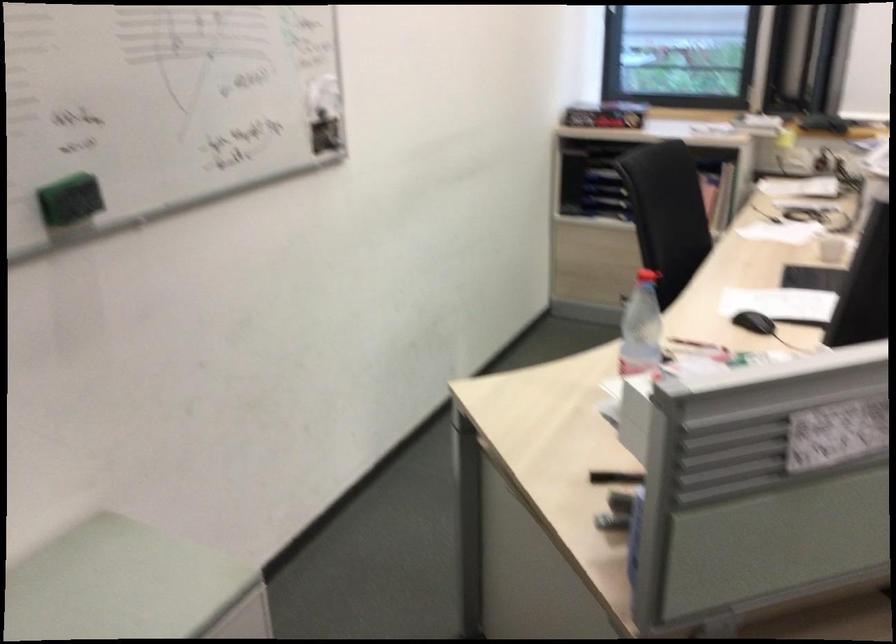
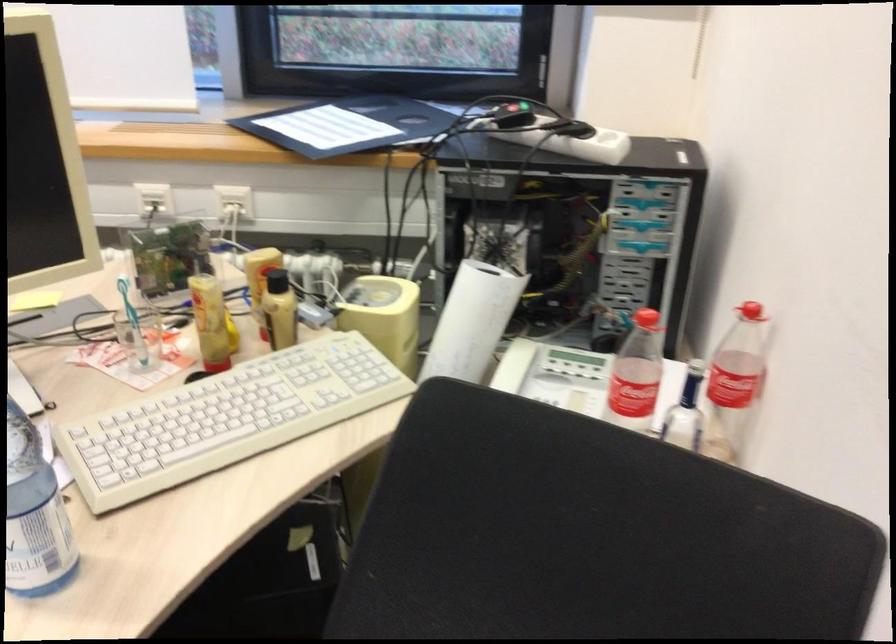
Which direction would the cameraman need to move to produce the second image?

The cameraman walked toward right, forward.